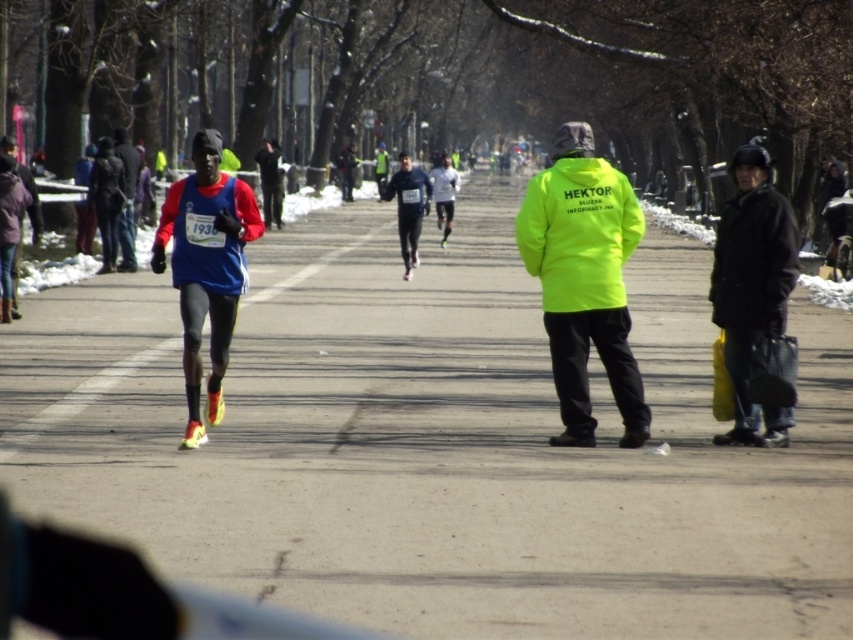
You are a photographer positioned at the starting line of the marathon. You need to capture a photo that includes both the matte blue running suit at left and the black matte jacket at right. Based on their sizes, which object should you focus on first to ensure both fit in the frame?

The matte blue running suit at left is wider than the black matte jacket at right. To ensure both fit in the frame, focus on the wider matte blue running suit at left first, then adjust the camera angle to include the narrower black matte jacket at right.

You are a drone operator tasked with capturing aerial footage of the marathon. The gray asphalt road at center is crucial for tracking runners. Based on the coordinates provided, where should you position the drone to ensure the road is centered in the frame?

The gray asphalt road at center is located at coordinates point [437,444], so positioning the drone at those coordinates will ensure the road is centered in the frame.